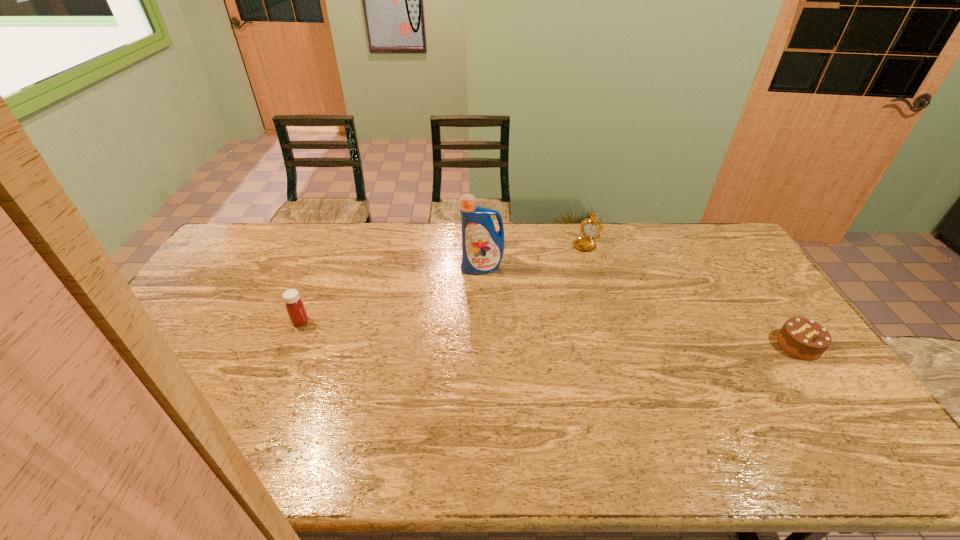
In order to click on the third farthest object in this screenshot , I will do `click(294, 305)`.

Find the location of a particular element. The image size is (960, 540). medicine is located at coordinates (294, 305).

I want to click on chocolate cake, so click(803, 338).

Locate an element on the screen. the rightmost object is located at coordinates (803, 338).

Where is `the farthest object`? The width and height of the screenshot is (960, 540). the farthest object is located at coordinates (590, 228).

Image resolution: width=960 pixels, height=540 pixels. Identify the location of the third object from left to right. (590, 228).

Identify the location of the tallest object. This screenshot has height=540, width=960. (482, 246).

Where is `the third object from right to left`? Image resolution: width=960 pixels, height=540 pixels. the third object from right to left is located at coordinates (482, 246).

This screenshot has height=540, width=960. What are the coordinates of `vacant region located 0.380m on the back of the third farthest object` in the screenshot? It's located at (x=333, y=244).

Locate an element on the screen. This screenshot has height=540, width=960. free space located on the back of the chocolate cake is located at coordinates (757, 286).